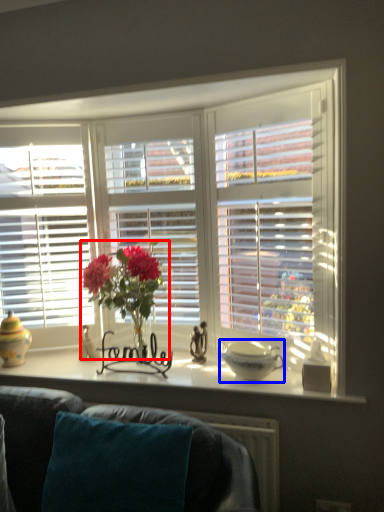
Question: Which point is further to the camera, floral arrangement (highlighted by a red box) or glass bowl (highlighted by a blue box)?

Choices:
 (A) floral arrangement
 (B) glass bowl

Answer: (B)